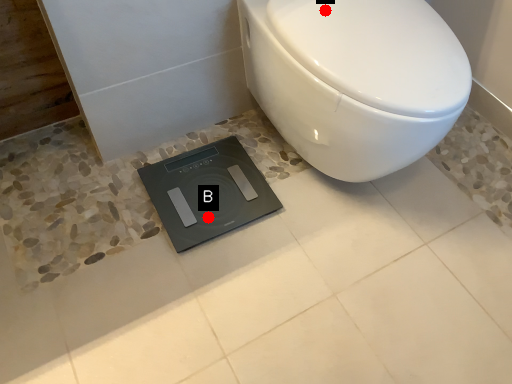
Question: Two points are circled on the image, labeled by A and B beside each circle. Among these points, which one is nearest to the camera?

Choices:
 (A) A is closer
 (B) B is closer

Answer: (A)